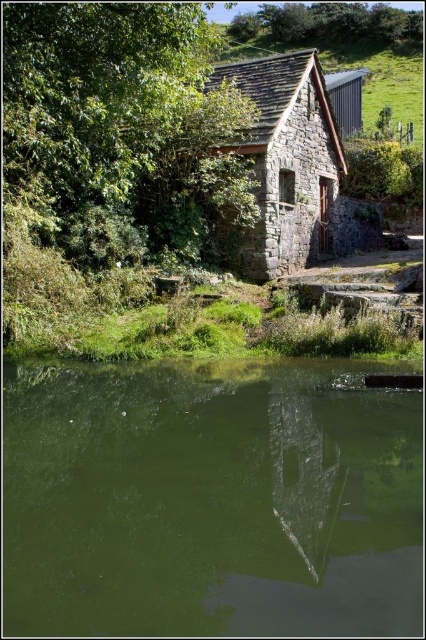
Between point (204, 72) and point (356, 3), which one is positioned in front?

Positioned in front is point (204, 72).

How distant is green leafy tree at upper left from green leafy tree at upper center?

green leafy tree at upper left is 195.55 feet away from green leafy tree at upper center.

You are a GUI agent. You are given a task and a screenshot of the screen. Output one action in this format:
    pyautogui.click(x=<x>, y=<y>)
    Task: Click on the green leafy tree at upper left
    This screenshot has width=426, height=640.
    Given the screenshot: What is the action you would take?
    pyautogui.click(x=120, y=129)

Where is `green leafy tree at upper left`? The height and width of the screenshot is (640, 426). green leafy tree at upper left is located at coordinates (120, 129).

Does rustic stone cottage at center have a larger size compared to green leafy tree at upper center?

No, rustic stone cottage at center is not bigger than green leafy tree at upper center.

Who is more distant from viewer, [279,243] or [308,20]?

Positioned behind is point [308,20].

Where is `rustic stone cottage at center`? rustic stone cottage at center is located at coordinates (287, 161).

Locate an element on the screen. This screenshot has width=426, height=640. rustic stone cottage at center is located at coordinates (287, 161).

Measure the distance between green leafy tree at upper left and rustic stone cottage at center.

7.99 meters

At what (x,y) coordinates should I click in order to perform the action: click on green leafy tree at upper left. Please return your answer as a coordinate pair (x, y). Looking at the image, I should click on (120, 129).